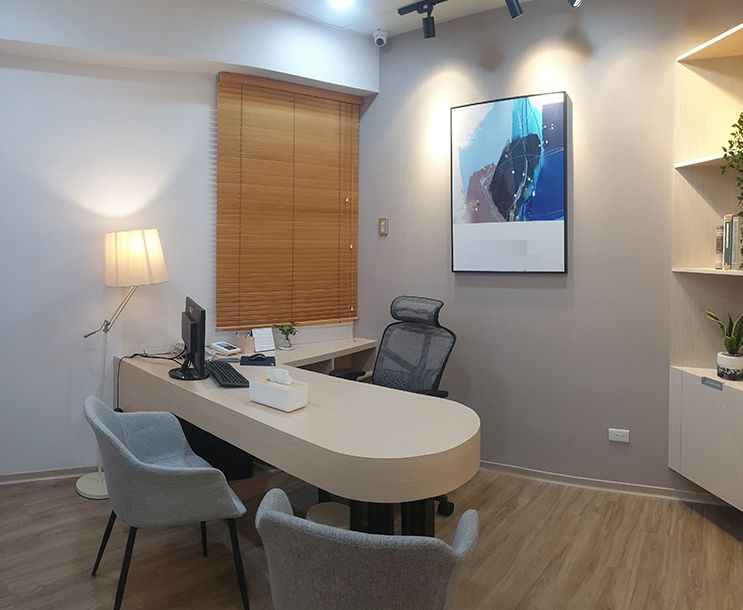
At what (x,y) coordinates should I click in order to perform the action: click on mouse pad. Please return your answer as a coordinate pair (x, y). Looking at the image, I should click on (259, 365).